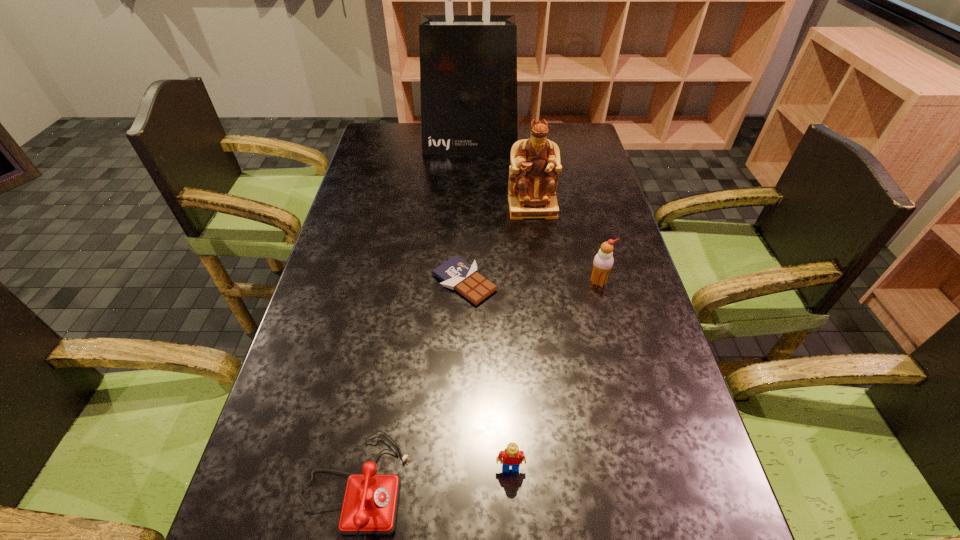
Find the location of `vacant point located at the front with a straw on the rightmost object`. vacant point located at the front with a straw on the rightmost object is located at coordinates (633, 419).

Locate an element on the screen. vacant space located on the face of the Lego is located at coordinates (514, 526).

Find the location of `free spot located 0.170m on the back of the chocolate bar`. free spot located 0.170m on the back of the chocolate bar is located at coordinates (467, 221).

Where is `object located in the far edge section of the desktop`? object located in the far edge section of the desktop is located at coordinates (468, 63).

What are the coordinates of `object present at the right edge` in the screenshot? It's located at (603, 261).

Where is `free space at the left edge of the desktop`? free space at the left edge of the desktop is located at coordinates (363, 221).

Where is `vacant space at the right edge of the desktop`? vacant space at the right edge of the desktop is located at coordinates (657, 359).

This screenshot has width=960, height=540. In the image, there is a desktop. Find the location of `vacant space at the far left corner`. vacant space at the far left corner is located at coordinates (396, 124).

You are a GUI agent. You are given a task and a screenshot of the screen. Output one action in this format:
    pyautogui.click(x=<x>, y=<y>)
    Task: Click on the vacant point located between the shopping bag and the Lego
    The image size is (960, 540).
    Given the screenshot: What is the action you would take?
    pyautogui.click(x=491, y=306)

This screenshot has width=960, height=540. Find the location of `unoccupied area between the shortest object and the tallest object`. unoccupied area between the shortest object and the tallest object is located at coordinates (468, 213).